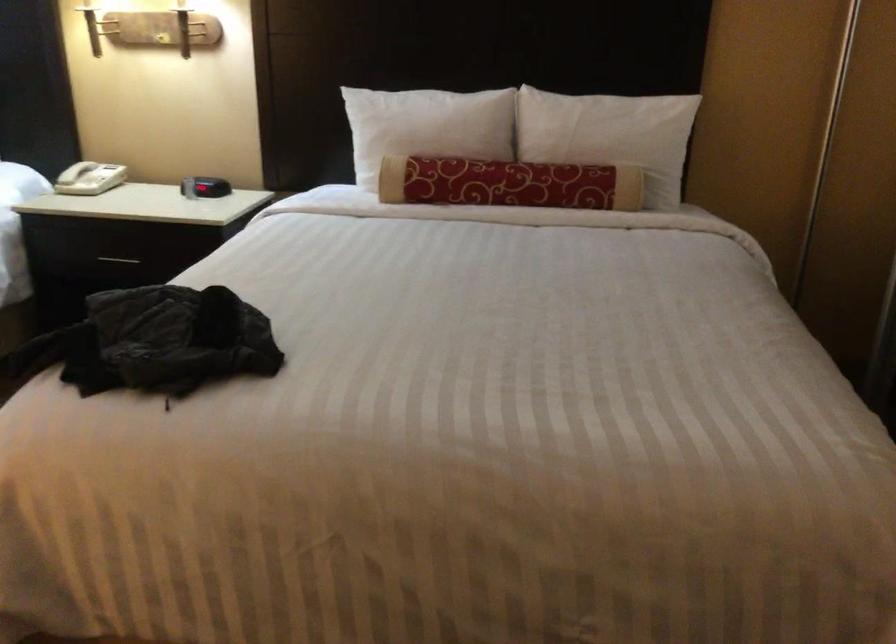
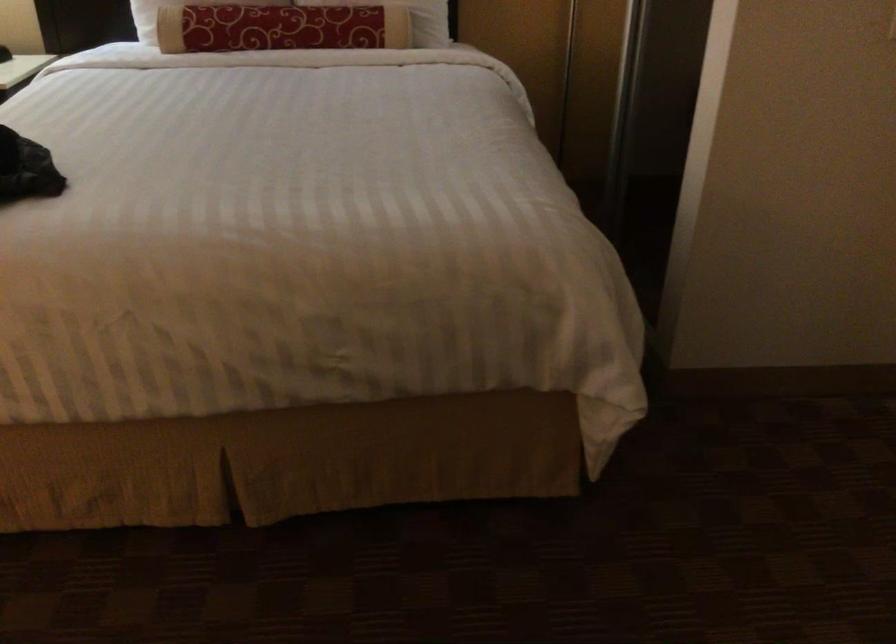
The point at (504, 182) is marked in the first image. Where is the corresponding point in the second image?

(280, 28)